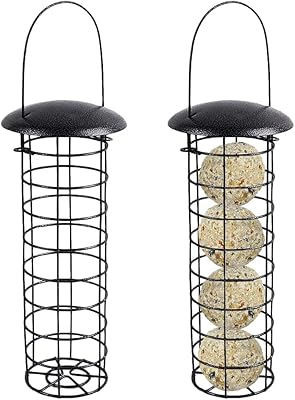
Locate an element on the screen. This screenshot has height=400, width=295. center bars is located at coordinates point(56,204), point(58,268), point(57,358), point(70,211), point(72,322), point(226,372), point(224,205).